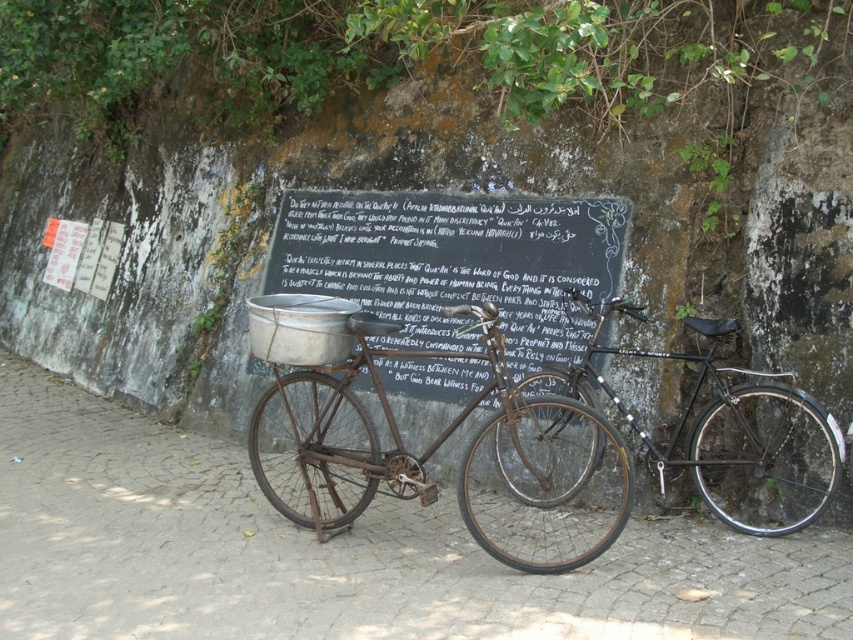
Question: Among these objects, which one is farthest from the camera?

Choices:
 (A) rusty metal bicycle at center
 (B) black chalkboard at center
 (C) black matte bicycle at center

Answer: (B)

Question: Which object is farther from the camera taking this photo?

Choices:
 (A) black matte bicycle at center
 (B) black chalkboard at center

Answer: (B)

Question: Can you confirm if rusty metal bicycle at center is positioned to the right of black chalkboard at center?

Choices:
 (A) yes
 (B) no

Answer: (B)

Question: Can you confirm if rusty metal bicycle at center is positioned below black chalkboard at center?

Choices:
 (A) no
 (B) yes

Answer: (B)

Question: Which of these objects is positioned farthest from the black chalkboard at center?

Choices:
 (A) black matte bicycle at center
 (B) rusty metal bicycle at center

Answer: (A)

Question: Can you confirm if black chalkboard at center is positioned to the left of black matte bicycle at center?

Choices:
 (A) no
 (B) yes

Answer: (B)